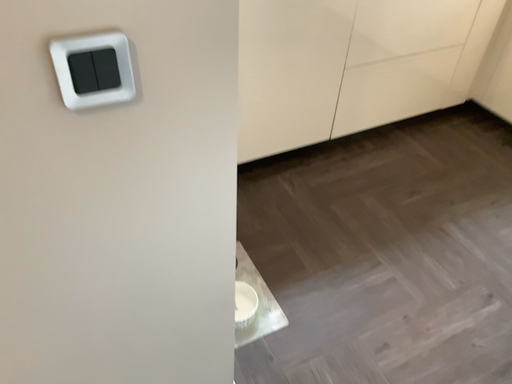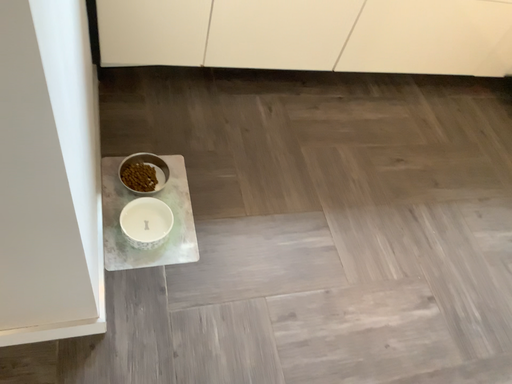
Question: Which way did the camera rotate in the video?

Choices:
 (A) rotated upward
 (B) rotated downward

Answer: (B)